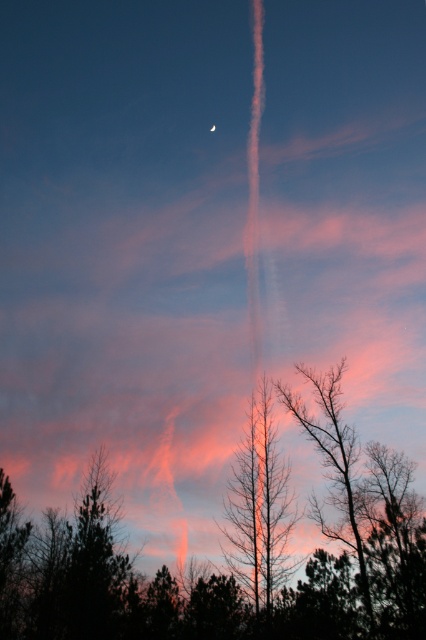
Question: Can you confirm if silhouette bare tree at center is positioned to the left of bare branches at lower right?

Choices:
 (A) no
 (B) yes

Answer: (B)

Question: Which point is farther from the camera taking this photo?

Choices:
 (A) (402, 573)
 (B) (253, 467)

Answer: (B)

Question: Is bare branches at center to the right of bare branches at lower right from the viewer's perspective?

Choices:
 (A) yes
 (B) no

Answer: (B)

Question: Which point appears farthest from the camera in this image?

Choices:
 (A) (374, 476)
 (B) (261, 586)

Answer: (A)

Question: Which of the following is the closest to the observer?

Choices:
 (A) silhouette bare tree at center
 (B) bare branches at lower right
 (C) bare branches at center

Answer: (A)

Question: Observing the image, what is the correct spatial positioning of silhouette bare tree at center in reference to bare branches at center?

Choices:
 (A) left
 (B) right

Answer: (A)